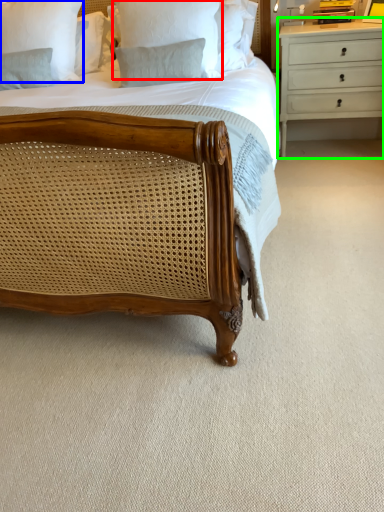
Question: Considering the real-world distances, which object is closest to pillow (highlighted by a red box)? pillow (highlighted by a blue box) or chest of drawers (highlighted by a green box).

Choices:
 (A) pillow
 (B) chest of drawers

Answer: (A)